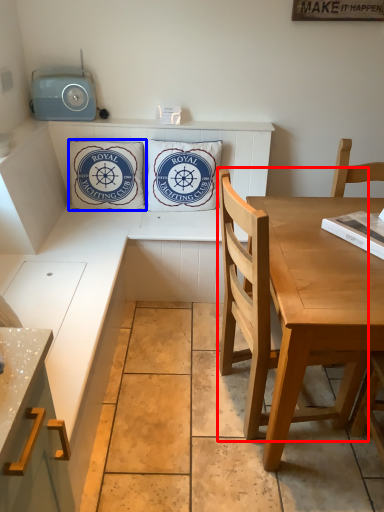
Question: Which object is closer to the camera taking this photo, chair (highlighted by a red box) or pillow (highlighted by a blue box)?

Choices:
 (A) chair
 (B) pillow

Answer: (A)